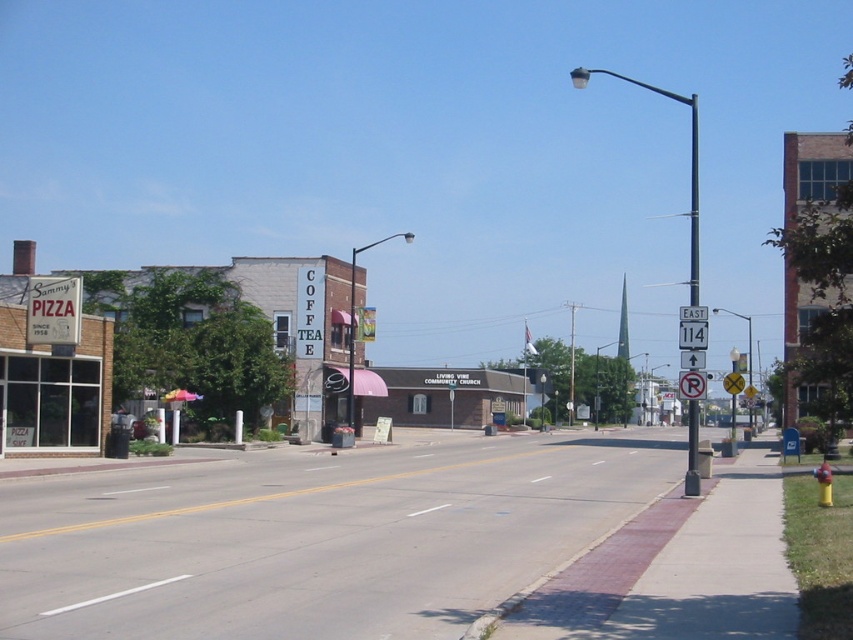
You are a delivery driver who needs to turn left onto a side street. You see a white plastic street sign at upper right and a metallic pole at right. Which object is closer to the direction you want to turn?

The white plastic street sign at upper right is to the left of the metallic pole at right, so it is closer to the left direction you want to turn.